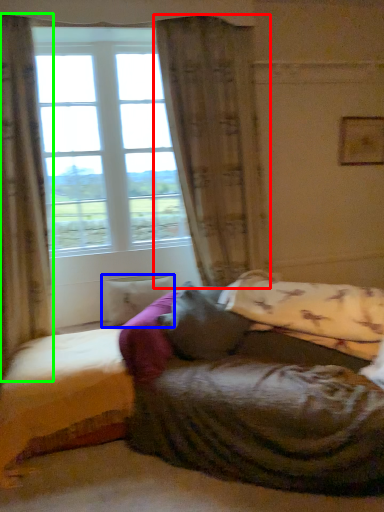
Question: Estimate the real-world distances between objects in this image. Which object is closer to curtain (highlighted by a red box), pillow (highlighted by a blue box) or curtain (highlighted by a green box)?

Choices:
 (A) pillow
 (B) curtain

Answer: (A)